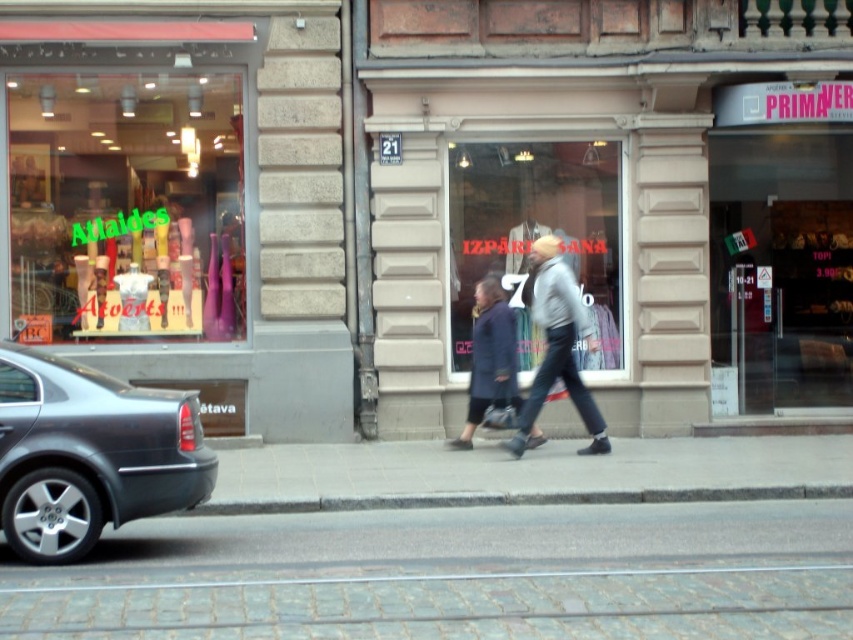
Question: Which object appears farthest from the camera in this image?

Choices:
 (A) translucent glass vase at left
 (B) dark blue coat at center
 (C) dark gray metallic car at left
 (D) matte glass window at center

Answer: (A)

Question: Which of the following is the farthest from the observer?

Choices:
 (A) gray knit sweater at center
 (B) transparent glass display at center

Answer: (B)

Question: Is matte glass window at center to the right of dark gray metallic car at left from the viewer's perspective?

Choices:
 (A) no
 (B) yes

Answer: (B)

Question: Is dark gray metallic car at left closer to the viewer compared to gray knit sweater at center?

Choices:
 (A) yes
 (B) no

Answer: (A)

Question: Does transparent glass display at center appear under gray knit sweater at center?

Choices:
 (A) no
 (B) yes

Answer: (A)

Question: Which object appears farthest from the camera in this image?

Choices:
 (A) gray knit sweater at center
 (B) translucent glass vase at left
 (C) matte glass window at center

Answer: (B)